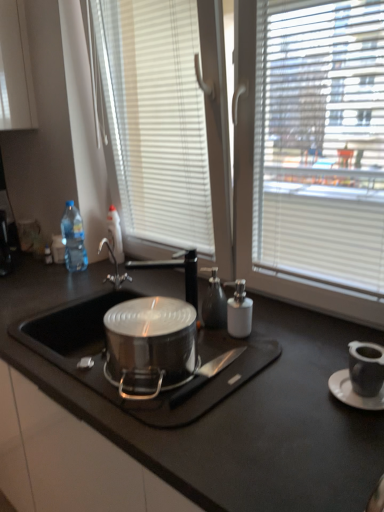
What are the coordinates of `free location to the left of black matte knife at center` in the screenshot? It's located at (132, 386).